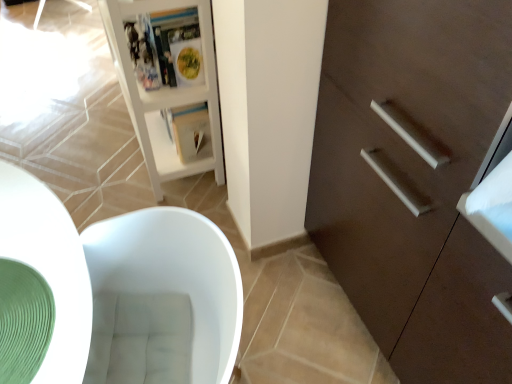
Question: Could you tell me if dark brown wood cabinet at right is turned towards matte plastic magazine at upper center, which is the 1th magazine from front to back?

Choices:
 (A) no
 (B) yes

Answer: (A)

Question: Is dark brown wood cabinet at right further to the viewer compared to matte plastic magazine at upper center, which ranks as the 2th magazine in back-to-front order?

Choices:
 (A) yes
 (B) no

Answer: (B)

Question: Does dark brown wood cabinet at right have a larger size compared to matte plastic magazine at upper center, which is the 1th magazine from front to back?

Choices:
 (A) yes
 (B) no

Answer: (A)

Question: Does dark brown wood cabinet at right have a lesser height compared to matte plastic magazine at upper center, which is the 1th magazine from front to back?

Choices:
 (A) yes
 (B) no

Answer: (B)

Question: From the image's perspective, is dark brown wood cabinet at right located beneath matte plastic magazine at upper center, which is the 1th magazine from front to back?

Choices:
 (A) no
 (B) yes

Answer: (B)

Question: Is green rubber mat at lower left situated inside dark brown wood cabinet at right or outside?

Choices:
 (A) inside
 (B) outside

Answer: (B)

Question: In terms of height, does green rubber mat at lower left look taller or shorter compared to dark brown wood cabinet at right?

Choices:
 (A) tall
 (B) short

Answer: (B)

Question: In terms of width, does green rubber mat at lower left look wider or thinner when compared to dark brown wood cabinet at right?

Choices:
 (A) thin
 (B) wide

Answer: (A)

Question: From a real-world perspective, is green rubber mat at lower left above or below dark brown wood cabinet at right?

Choices:
 (A) above
 (B) below

Answer: (A)

Question: Which is correct: white glossy bookshelf at upper left is inside white paper magazine at center, which ranks as the 1th magazine in back-to-front order, or outside of it?

Choices:
 (A) inside
 (B) outside

Answer: (B)

Question: In the image, is white glossy bookshelf at upper left on the left side or the right side of white paper magazine at center, which ranks as the 1th magazine in back-to-front order?

Choices:
 (A) right
 (B) left

Answer: (B)

Question: From the image's perspective, is white glossy bookshelf at upper left above or below white paper magazine at center, the second magazine positioned from the front?

Choices:
 (A) above
 (B) below

Answer: (A)

Question: In the image, is white glossy bookshelf at upper left positioned in front of or behind white paper magazine at center, which ranks as the 1th magazine in back-to-front order?

Choices:
 (A) behind
 (B) front

Answer: (B)

Question: Is dark brown wood cabinet at right in front of or behind white glossy bookshelf at upper left in the image?

Choices:
 (A) front
 (B) behind

Answer: (A)

Question: Would you say dark brown wood cabinet at right is to the left or to the right of white glossy bookshelf at upper left in the picture?

Choices:
 (A) left
 (B) right

Answer: (B)